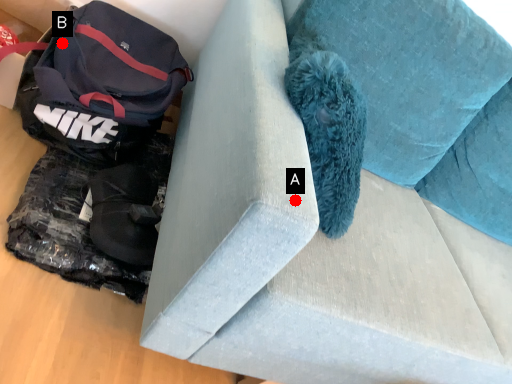
Question: Two points are circled on the image, labeled by A and B beside each circle. Which point appears farthest from the camera in this image?

Choices:
 (A) A is further
 (B) B is further

Answer: (B)